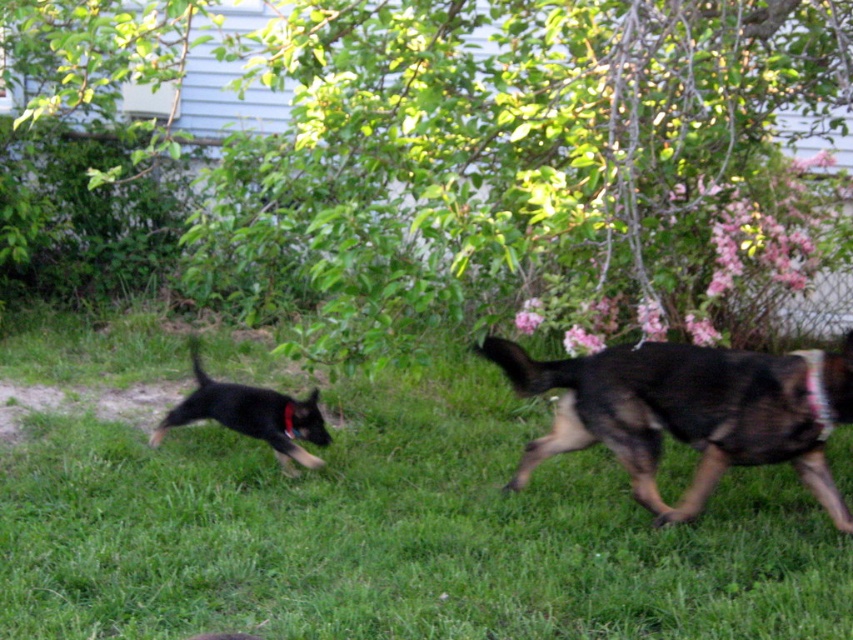
You are a photographer trying to capture both the black fur dog at right and the black glossy dog at left in a single shot. Based on their positions, which dog will appear larger in the photo?

The black glossy dog at left will appear larger in the photo because it is closer to the camera than the black fur dog at right, which is positioned further away.